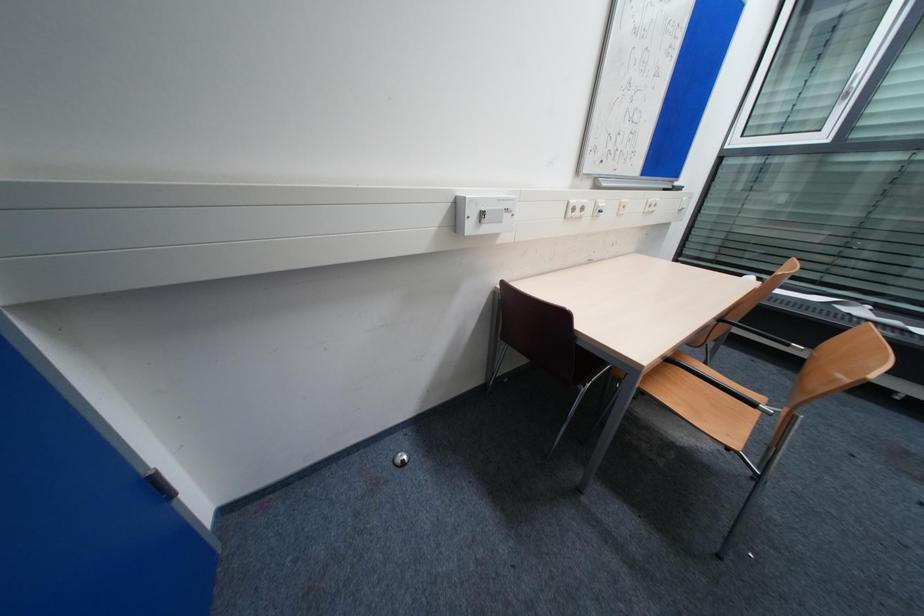
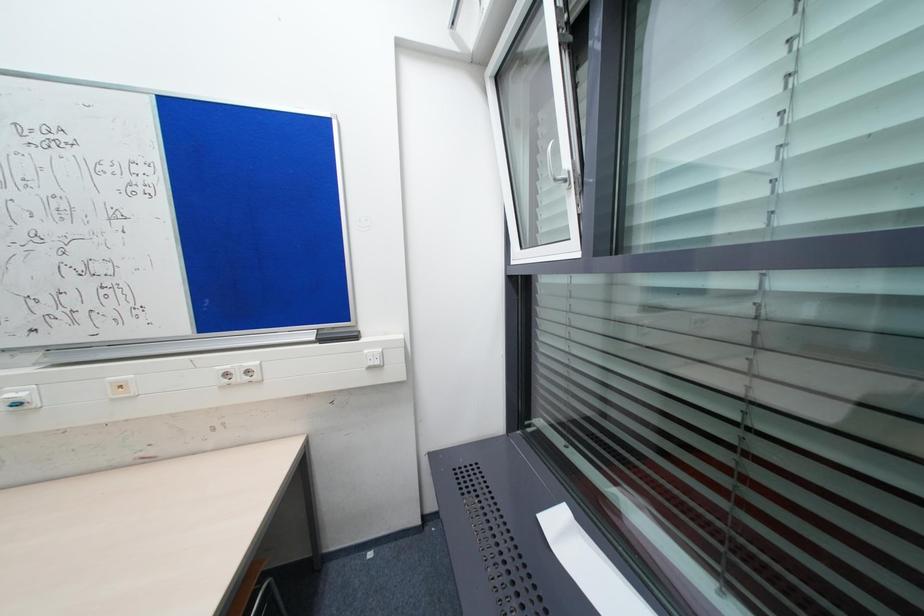
The images are taken continuously from a first-person perspective. In which direction are you moving?

The cameraman moved toward right, forward.